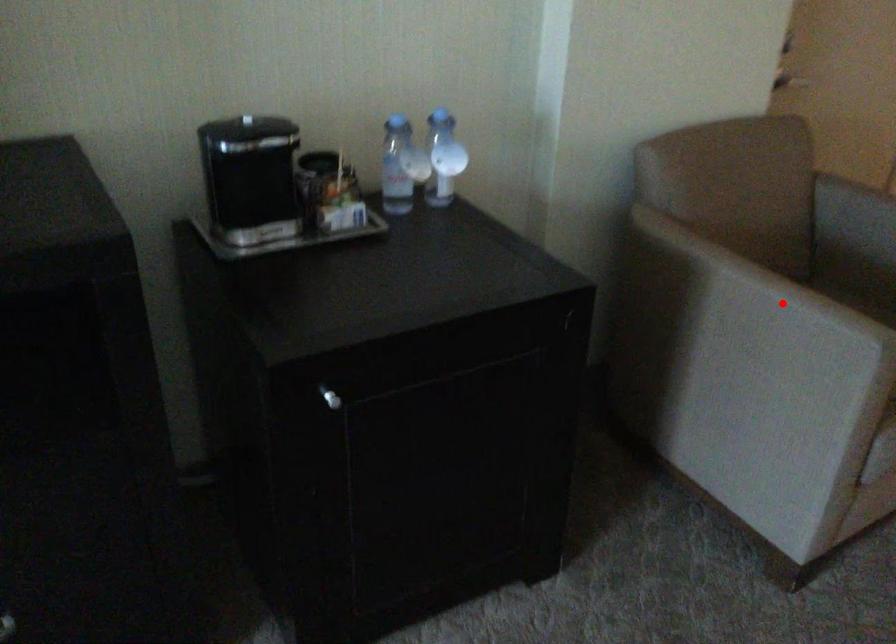
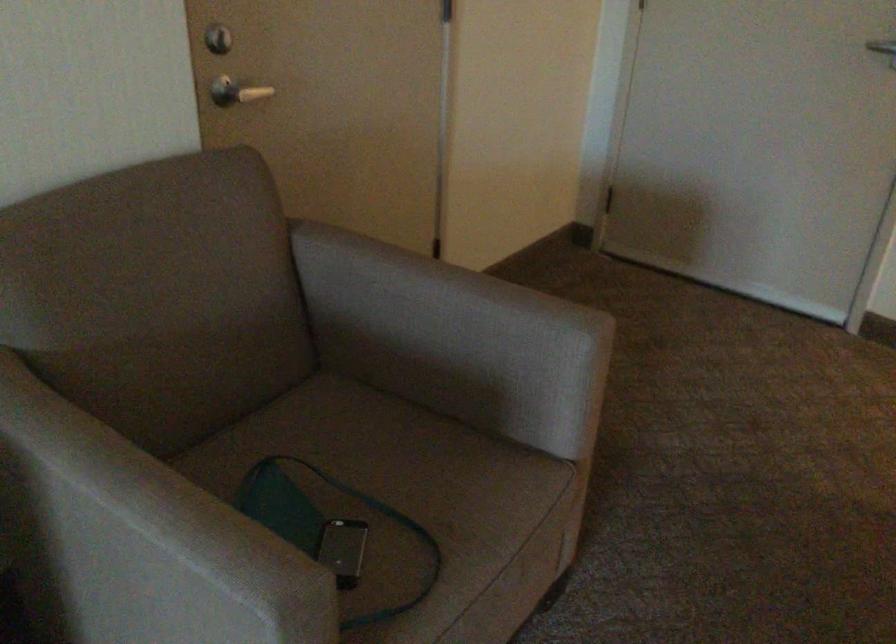
Locate, in the second image, the point that corresponds to the highlighted location in the first image.

(150, 538)